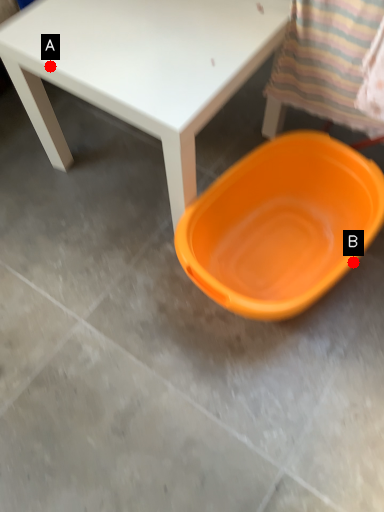
Question: Two points are circled on the image, labeled by A and B beside each circle. Which point is closer to the camera?

Choices:
 (A) A is closer
 (B) B is closer

Answer: (A)